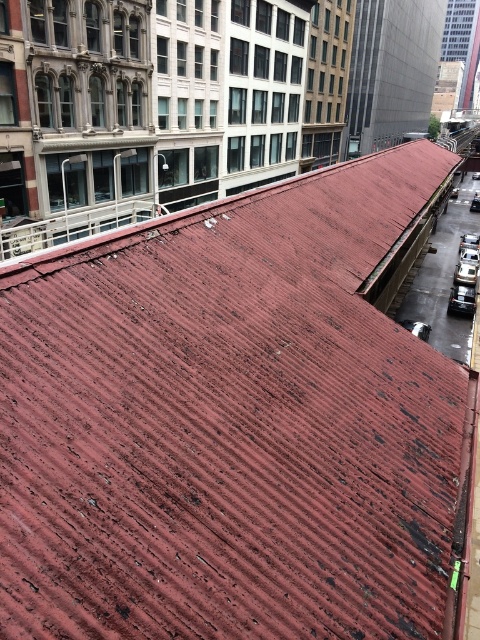
Question: Is shiny silver car at lower right wider than white glossy car at lower right?

Choices:
 (A) no
 (B) yes

Answer: (B)

Question: From the image, what is the correct spatial relationship of shiny silver car at lower right in relation to white glossy car at lower right?

Choices:
 (A) right
 (B) left

Answer: (B)

Question: Is shiny silver car at lower right thinner than white glossy car at lower right?

Choices:
 (A) no
 (B) yes

Answer: (A)

Question: Which object is farther from the camera taking this photo?

Choices:
 (A) shiny silver car at lower right
 (B) white glossy car at lower right

Answer: (B)